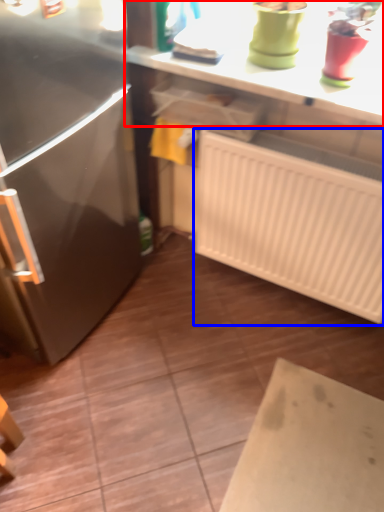
Question: Which object appears farthest to the camera in this image, countertop (highlighted by a red box) or radiator (highlighted by a blue box)?

Choices:
 (A) countertop
 (B) radiator

Answer: (B)